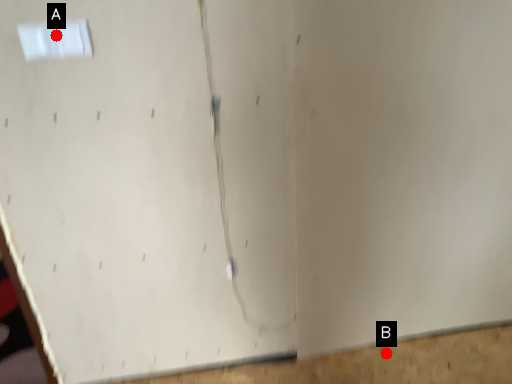
Question: Two points are circled on the image, labeled by A and B beside each circle. Which point is farther from the camera taking this photo?

Choices:
 (A) A is further
 (B) B is further

Answer: (B)